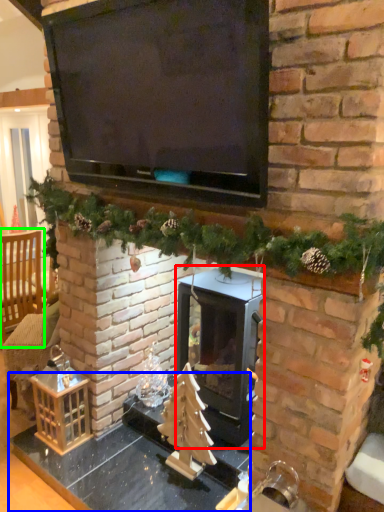
Question: Which is nearer to the wood burning stove (highlighted by a red box)? table (highlighted by a blue box) or armchair (highlighted by a green box).

Choices:
 (A) table
 (B) armchair

Answer: (A)